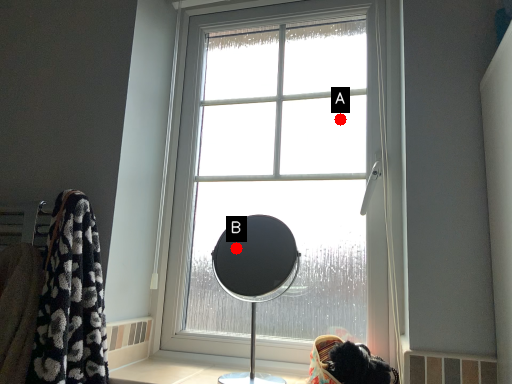
Question: Two points are circled on the image, labeled by A and B beside each circle. Which point appears farthest from the camera in this image?

Choices:
 (A) A is further
 (B) B is further

Answer: (B)